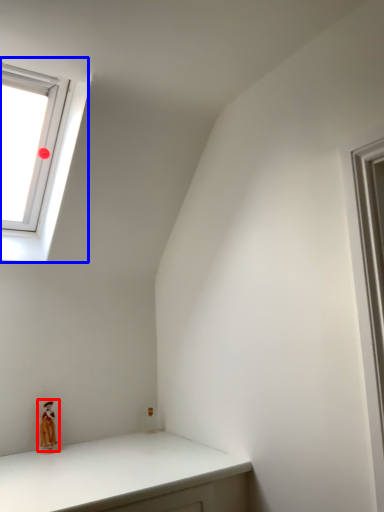
Question: Which of the following is the farthest to the observer, doll (highlighted by a red box) or window (highlighted by a blue box)?

Choices:
 (A) doll
 (B) window

Answer: (A)